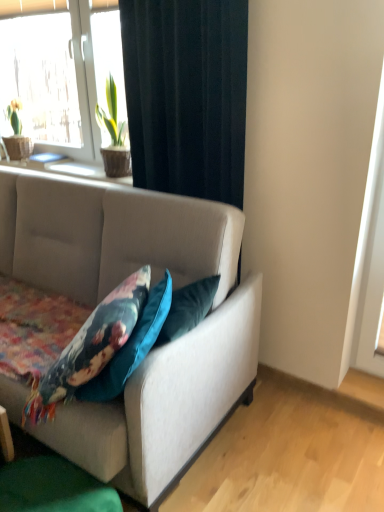
Question: Is black fabric curtain at upper center to the left of textured beige studio couch at center from the viewer's perspective?

Choices:
 (A) no
 (B) yes

Answer: (A)

Question: From the image's perspective, is black fabric curtain at upper center under textured beige studio couch at center?

Choices:
 (A) yes
 (B) no

Answer: (B)

Question: Is black fabric curtain at upper center shorter than textured beige studio couch at center?

Choices:
 (A) yes
 (B) no

Answer: (B)

Question: Is black fabric curtain at upper center bigger than textured beige studio couch at center?

Choices:
 (A) yes
 (B) no

Answer: (B)

Question: Is black fabric curtain at upper center beside textured beige studio couch at center?

Choices:
 (A) yes
 (B) no

Answer: (B)

Question: Is black fabric curtain at upper center closer to camera compared to textured beige studio couch at center?

Choices:
 (A) yes
 (B) no

Answer: (B)

Question: Considering the relative positions of textured beige studio couch at center and white plastic window at upper left in the image provided, is textured beige studio couch at center to the right of white plastic window at upper left from the viewer's perspective?

Choices:
 (A) yes
 (B) no

Answer: (A)

Question: From the image's perspective, does textured beige studio couch at center appear higher than white plastic window at upper left?

Choices:
 (A) yes
 (B) no

Answer: (B)

Question: Is textured beige studio couch at center positioned far away from white plastic window at upper left?

Choices:
 (A) yes
 (B) no

Answer: (A)

Question: Is textured beige studio couch at center turned away from white plastic window at upper left?

Choices:
 (A) no
 (B) yes

Answer: (A)

Question: From the image's perspective, does textured beige studio couch at center appear lower than white plastic window at upper left?

Choices:
 (A) yes
 (B) no

Answer: (A)

Question: Considering the relative sizes of textured beige studio couch at center and white plastic window at upper left in the image provided, is textured beige studio couch at center wider than white plastic window at upper left?

Choices:
 (A) no
 (B) yes

Answer: (B)

Question: Is textured beige studio couch at center placed right next to black fabric curtain at upper center?

Choices:
 (A) no
 (B) yes

Answer: (A)